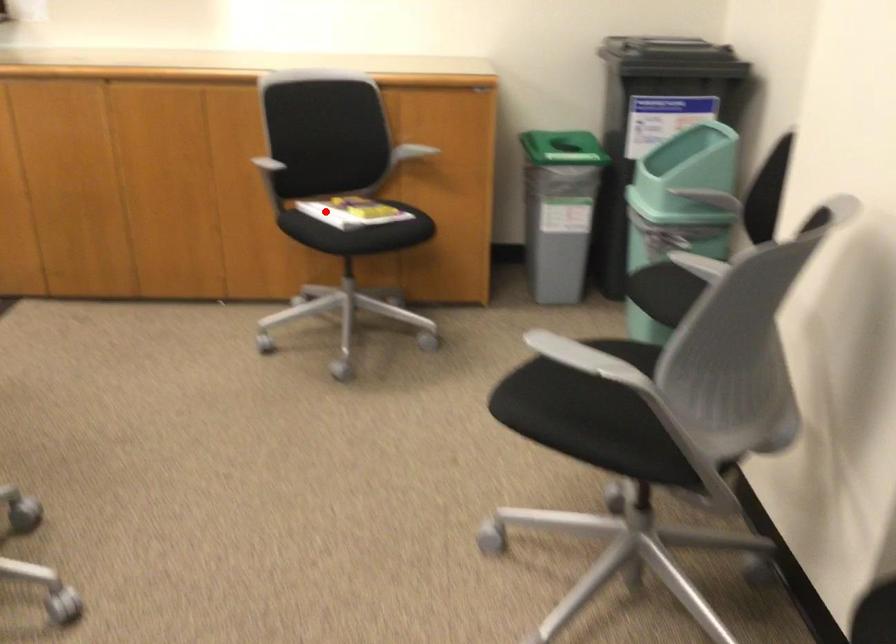
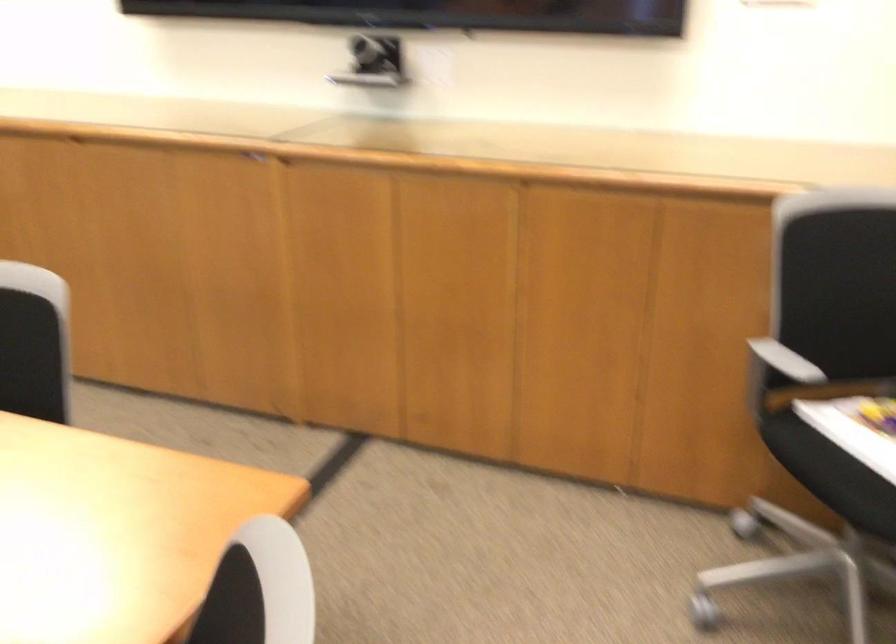
Question: A red point is marked in image1. In image2, is the corresponding 3D point closer to the camera or farther? Reply with the corresponding letter.

Choices:
 (A) The corresponding 3D point is closer.
 (B) The corresponding 3D point is farther.

Answer: (A)